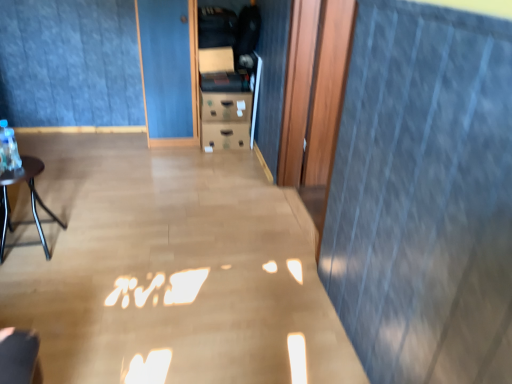
The image size is (512, 384). I want to click on empty space that is to the right of matte black table at left, so click(89, 250).